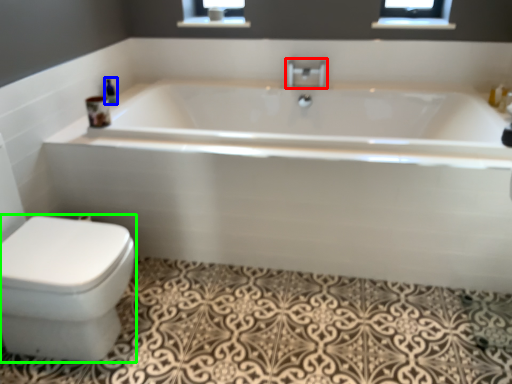
Question: Which object is the closest to the tap (highlighted by a red box)? Choose among these: toiletry (highlighted by a blue box) or bidet (highlighted by a green box).

Choices:
 (A) toiletry
 (B) bidet

Answer: (A)